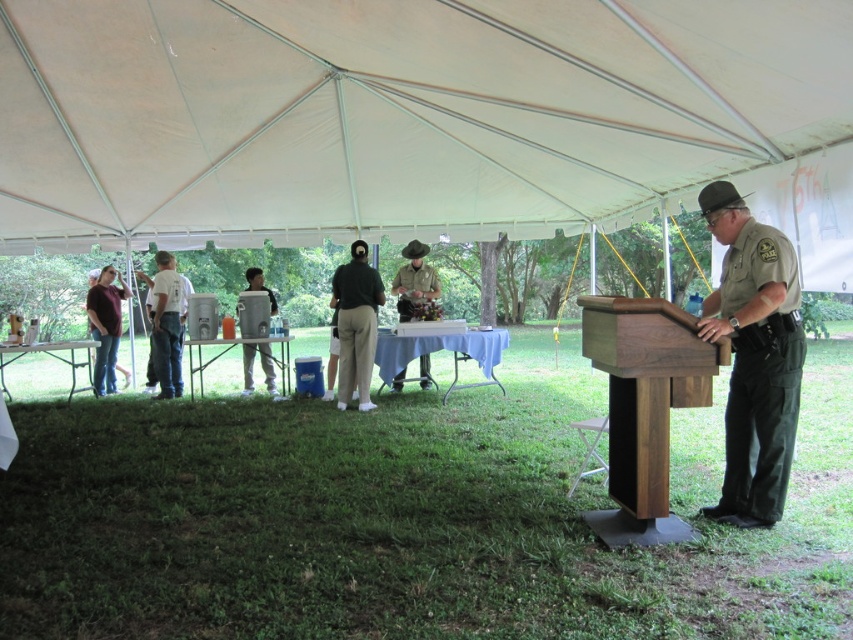
Looking at this image, you are attending an outdoor event under a large tent and notice two items of interest. One is the white fabric canopy at upper center and the other is the green fabric uniform at center. Which of these items is positioned higher relative to the ground?

The white fabric canopy at upper center is located above the green fabric uniform at center, so it is positioned higher relative to the ground.

You are standing at the entrance of the tent and want to find the white cotton shirt at left. According to the coordinates provided, in which area should you look for it?

The white cotton shirt at left is located at coordinates point (166, 324), which corresponds to the lower middle section of the tent.